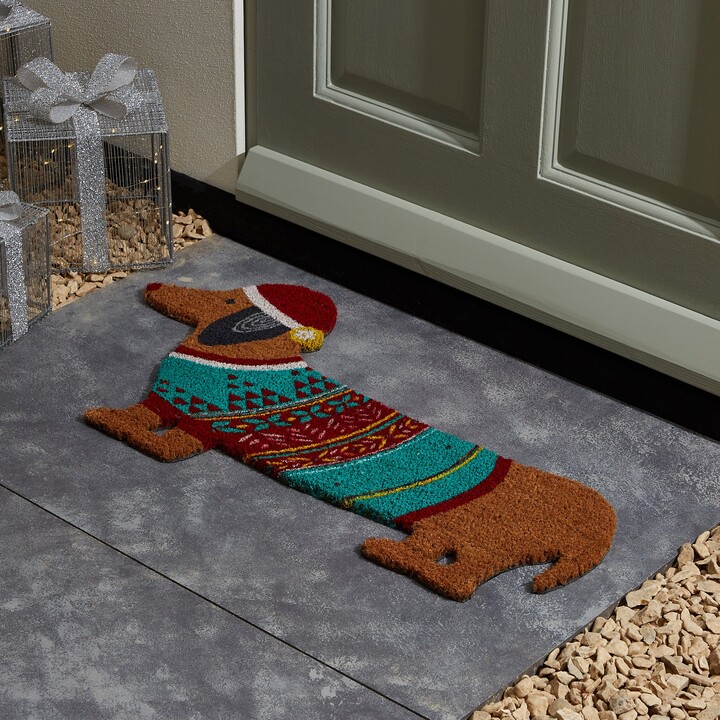
Identify the location of doormat. Image resolution: width=720 pixels, height=720 pixels. (525, 497).